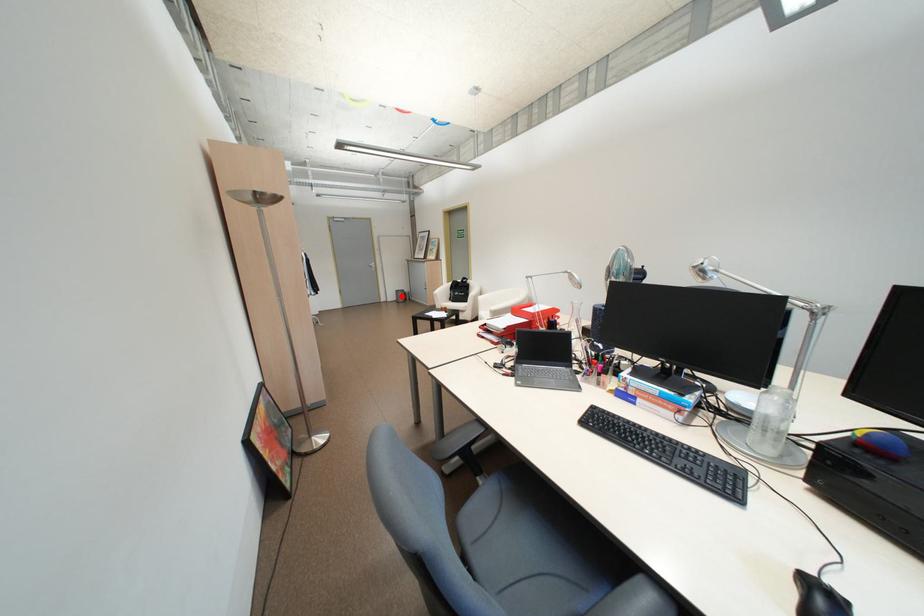
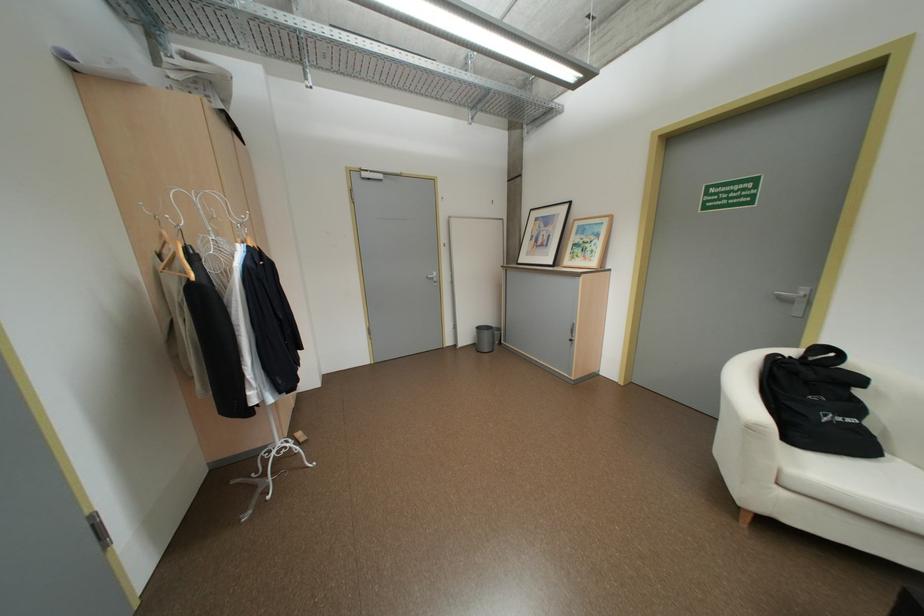
Locate, in the second image, the point that corresponds to the highlighted location in the first image.

(476, 338)